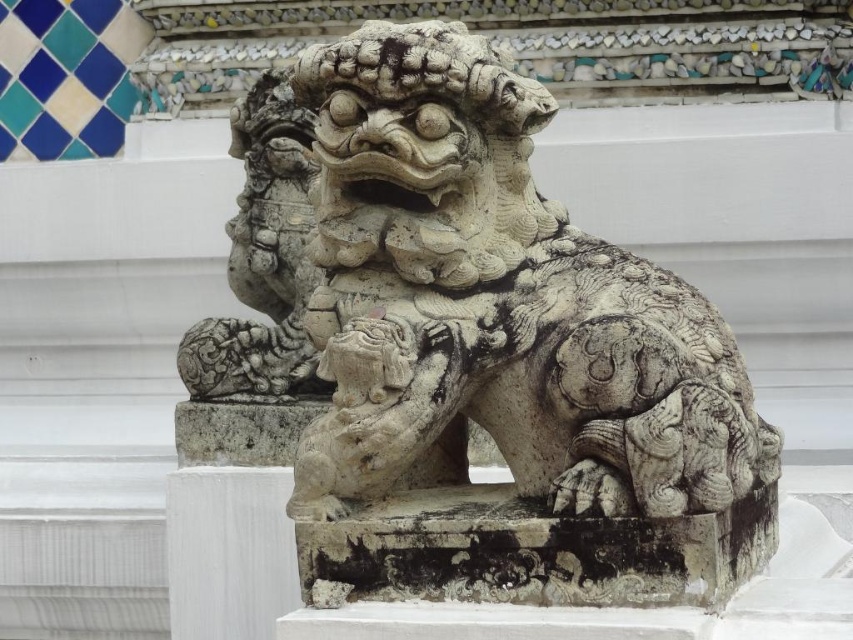
Question: Among these objects, which one is nearest to the camera?

Choices:
 (A) white stone lion at center
 (B) white marble pillar at center

Answer: (A)

Question: Which point is farther to the camera?

Choices:
 (A) (289, 186)
 (B) (250, 522)

Answer: (A)

Question: Does white stone lion at center have a smaller size compared to white marble pillar at center?

Choices:
 (A) yes
 (B) no

Answer: (B)

Question: Does white stone lion at center have a lesser width compared to white marble pillar at center?

Choices:
 (A) no
 (B) yes

Answer: (A)

Question: Can you confirm if white stone lion at center is smaller than white marble pillar at center?

Choices:
 (A) no
 (B) yes

Answer: (A)